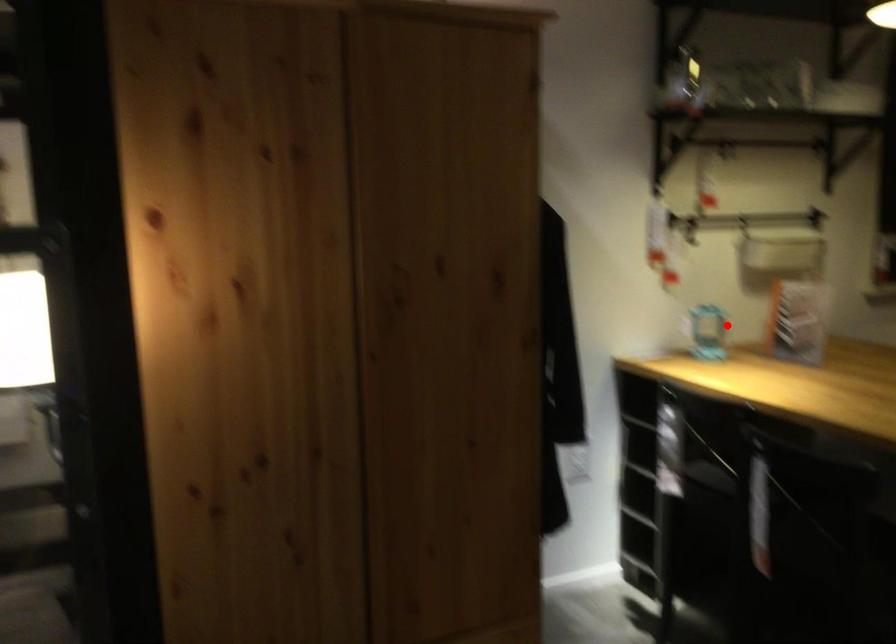
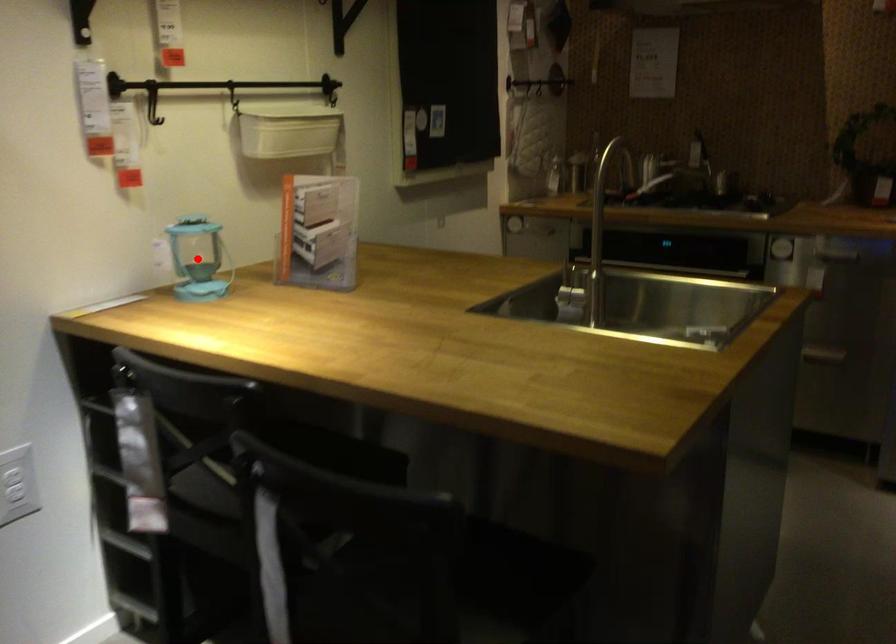
I am providing you with two images of the same scene from different viewpoints. A red point is marked on the first image and another point is marked on the second image. Is the marked point in image1 the same physical position as the marked point in image2?

Yes